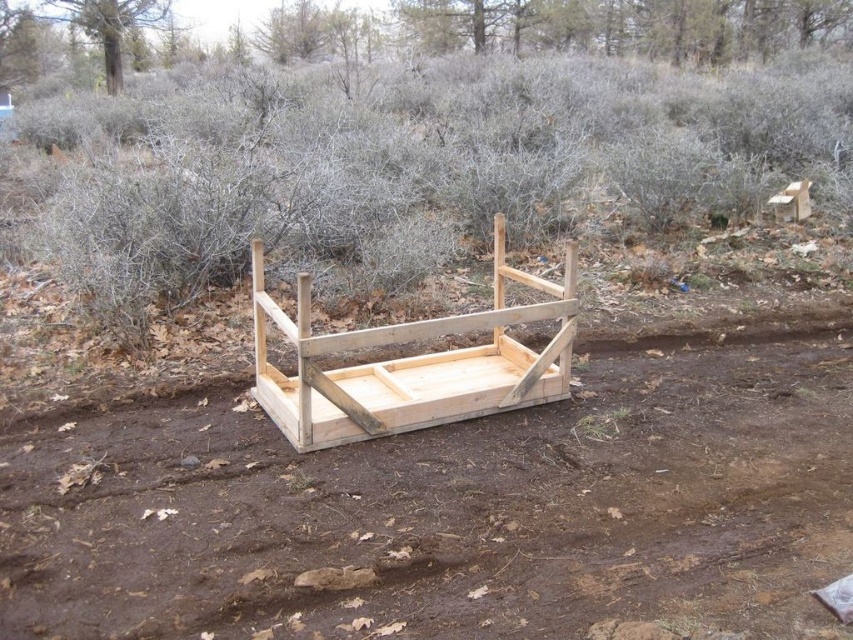
You are standing in the outdoor scene and want to place a 10 feet long wooden plank on the ground. The natural wood mud tray at center is in your way. Can you walk around it to place the plank without moving the tray?

The natural wood mud tray at center is 8.33 feet from viewer. Since the tray is only 8.33 feet away, you can walk around it to place the 10 feet plank without moving the tray.

Based on the photo, you are standing at the center of the wooden structure in the image. Looking around, you see a natural wood mud tray marked at point (447, 512). Which direction should you walk to reach the natural wood mud tray at center?

The natural wood mud tray at center is located at point (447, 512), which is the center of the image. Since you are already at the center of the wooden structure, you are already at the natural wood mud tray at center.